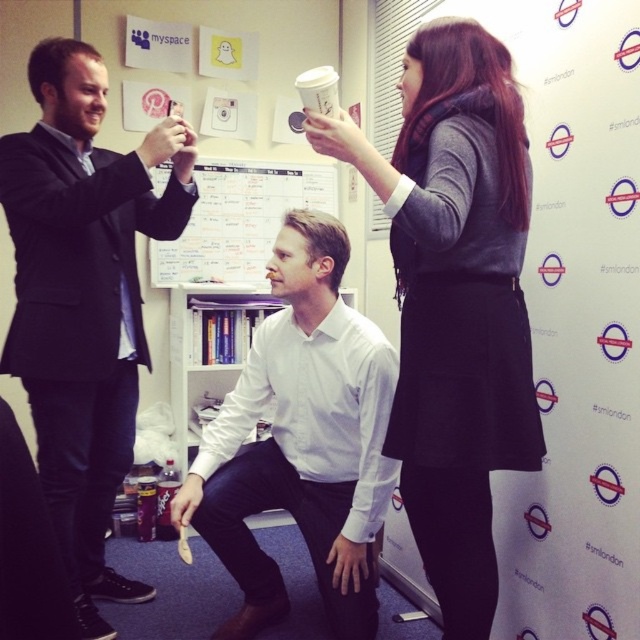
Question: Which point is farther from the camera taking this photo?

Choices:
 (A) (35, 228)
 (B) (333, 100)
 (C) (333, 317)

Answer: (C)

Question: Can you confirm if whiteboard at center is thinner than white paper cup at upper center?

Choices:
 (A) no
 (B) yes

Answer: (A)

Question: Among these objects, which one is nearest to the camera?

Choices:
 (A) white smooth shirt at center
 (B) whiteboard at center
 (C) dark gray sweater at upper center

Answer: (C)

Question: Can you confirm if white smooth shirt at center is bigger than whiteboard at center?

Choices:
 (A) no
 (B) yes

Answer: (B)

Question: Which point is closer to the camera?

Choices:
 (A) (403, 161)
 (B) (20, 289)
 (C) (218, 244)
 (D) (310, 68)

Answer: (A)

Question: Is dark gray sweater at upper center above whiteboard at center?

Choices:
 (A) no
 (B) yes

Answer: (A)